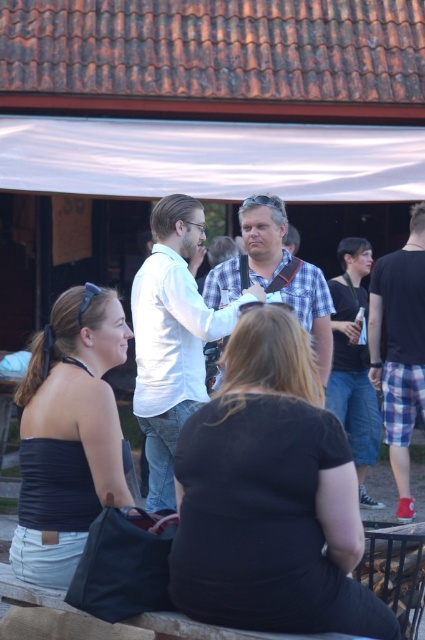
Is black matte shirt at center shorter than white cotton shirt at center?

Yes.

Does black matte shirt at center have a greater height compared to white cotton shirt at center?

Incorrect, black matte shirt at center's height is not larger of white cotton shirt at center's.

Is point (353, 474) positioned after point (170, 252)?

That is False.

Locate an element on the screen. This screenshot has height=640, width=425. black matte shirt at center is located at coordinates (269, 497).

Is point (261, 292) positioned before point (278, 266)?

Yes.

Which is behind, point (167, 365) or point (240, 269)?

Point (240, 269)

The image size is (425, 640). Describe the element at coordinates (172, 337) in the screenshot. I see `white cotton shirt at center` at that location.

You are a GUI agent. You are given a task and a screenshot of the screen. Output one action in this format:
    pyautogui.click(x=<x>, y=<y>)
    Task: Click on the white cotton shirt at center
    The height and width of the screenshot is (640, 425).
    Given the screenshot: What is the action you would take?
    pyautogui.click(x=172, y=337)

Is point (184, 216) positioned before point (394, 300)?

Yes, point (184, 216) is closer to viewer.

Can you confirm if white cotton shirt at center is positioned to the right of flannel shirt at right?

No, white cotton shirt at center is not to the right of flannel shirt at right.

Image resolution: width=425 pixels, height=640 pixels. I want to click on white cotton shirt at center, so click(x=172, y=337).